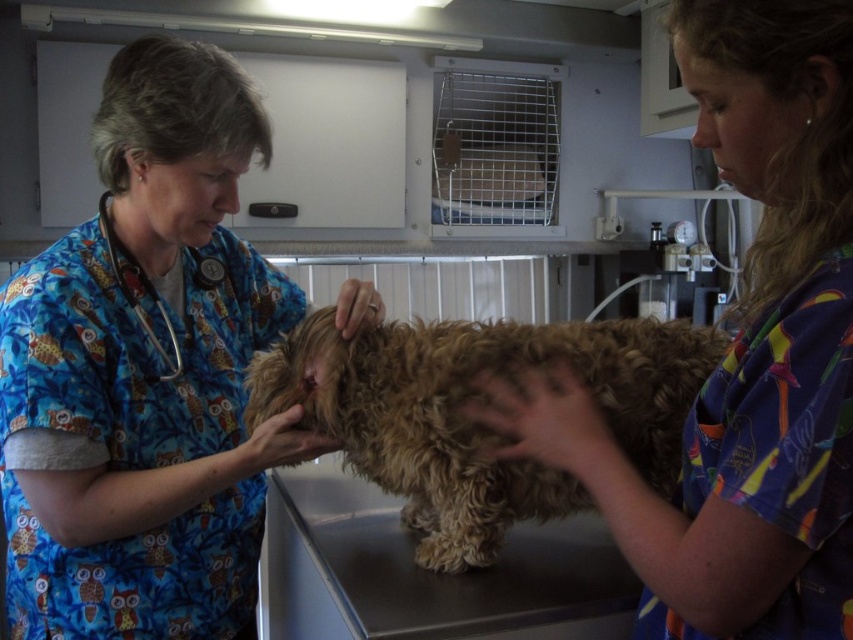
Which is more to the right, curly golden fur at center or blue fabric stethoscope at left?

From the viewer's perspective, curly golden fur at center appears more on the right side.

Find the location of `curly golden fur at center`. curly golden fur at center is located at coordinates (473, 424).

Is point (786, 193) positioned behind point (181, 368)?

No, it is not.

Who is higher up, multicolored scrubs at center or blue fabric stethoscope at left?

blue fabric stethoscope at left is above.

Does point (699, 74) come in front of point (132, 304)?

Yes.

Identify the location of multicolored scrubs at center. Image resolution: width=853 pixels, height=640 pixels. (746, 353).

Is blue printed scrubs at center thinner than curly golden fur at center?

Yes, blue printed scrubs at center is thinner than curly golden fur at center.

Is the position of blue printed scrubs at center more distant than that of curly golden fur at center?

No, it is in front of curly golden fur at center.

What do you see at coordinates (144, 372) in the screenshot? I see `blue printed scrubs at center` at bounding box center [144, 372].

This screenshot has height=640, width=853. In order to click on blue printed scrubs at center in this screenshot , I will do `click(144, 372)`.